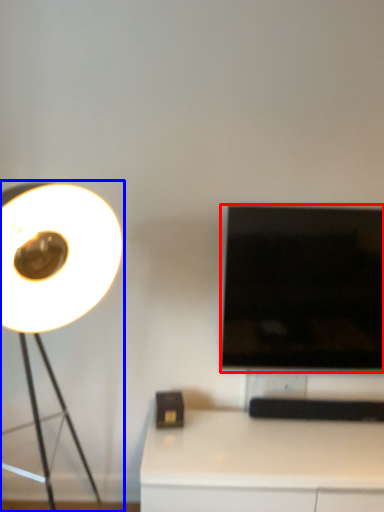
Question: Which object is further to the camera taking this photo, television (highlighted by a red box) or lamp (highlighted by a blue box)?

Choices:
 (A) television
 (B) lamp

Answer: (A)